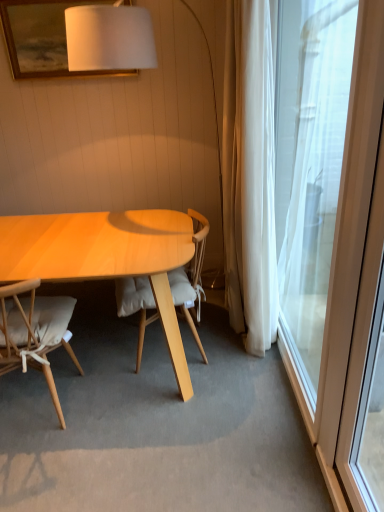
Locate an element on the screen. free point to the right of light wood/wooden chair at center, the 2th chair in the left-to-right sequence is located at coordinates (239, 365).